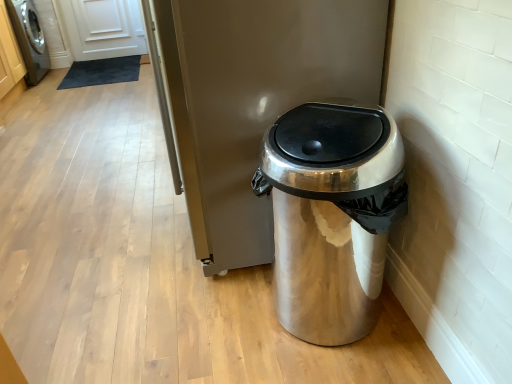
You are a GUI agent. You are given a task and a screenshot of the screen. Output one action in this format:
    pyautogui.click(x=<x>, y=<y>)
    Task: Click on the vacant space to the left of shiny metallic trash can at lower right
    This screenshot has width=512, height=384.
    Given the screenshot: What is the action you would take?
    pyautogui.click(x=215, y=319)